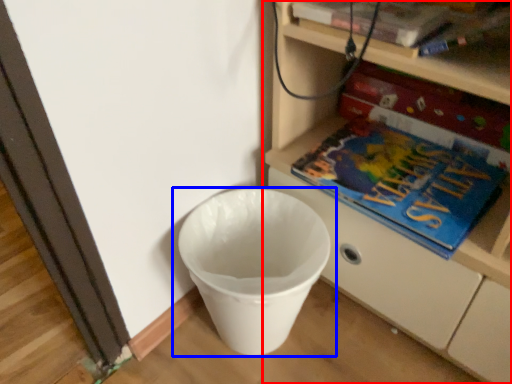
Question: Which object is closer to the camera taking this photo, shelf (highlighted by a red box) or waste container (highlighted by a blue box)?

Choices:
 (A) shelf
 (B) waste container

Answer: (A)